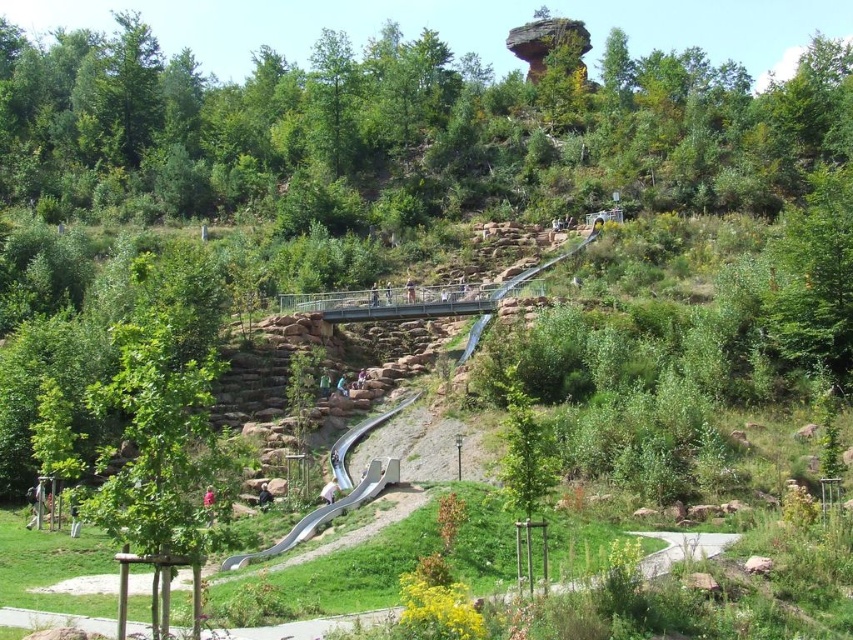
Question: Which point appears closest to the camera in this image?

Choices:
 (A) (160, 595)
 (B) (332, 516)

Answer: (A)

Question: Is green leafy tree at lower left to the right of smooth gray slide at lower center from the viewer's perspective?

Choices:
 (A) no
 (B) yes

Answer: (A)

Question: Does green leafy tree at lower left have a lesser width compared to smooth gray slide at lower center?

Choices:
 (A) yes
 (B) no

Answer: (B)

Question: Can you confirm if green leafy tree at lower left is positioned below smooth gray slide at lower center?

Choices:
 (A) no
 (B) yes

Answer: (A)